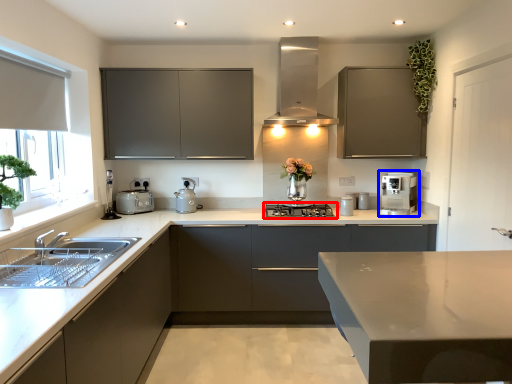
Question: Which object appears closest to the camera in this image, home appliance (highlighted by a red box) or home appliance (highlighted by a blue box)?

Choices:
 (A) home appliance
 (B) home appliance

Answer: (A)